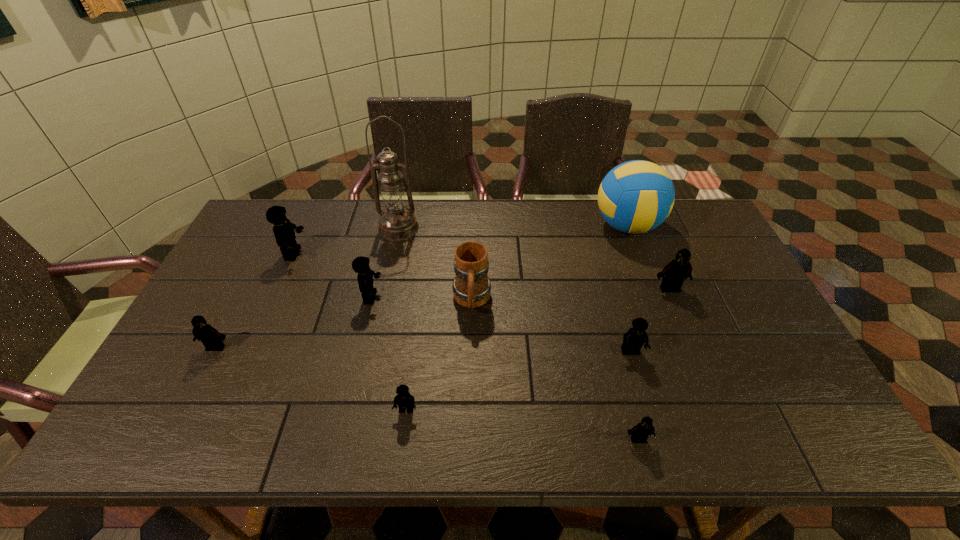
The height and width of the screenshot is (540, 960). Identify the location of vacant space situated on the front-facing side of the farthest yellow Lego. (377, 254).

The height and width of the screenshot is (540, 960). What are the coordinates of `vacant space located on the side of the mug with the handle` in the screenshot? It's located at pos(470,379).

In order to click on vacant space located on the face of the farthest black Lego in this screenshot , I will do `click(686, 328)`.

Image resolution: width=960 pixels, height=540 pixels. I want to click on vacant region located on the front-facing side of the fifth Lego from right to left, so click(x=423, y=298).

You are a GUI agent. You are given a task and a screenshot of the screen. Output one action in this format:
    pyautogui.click(x=<x>, y=<y>)
    Task: Click on the free space located on the face of the leftmost object
    The height and width of the screenshot is (540, 960).
    Given the screenshot: What is the action you would take?
    pyautogui.click(x=167, y=442)

Find the location of a particular element. The image size is (960, 540). vacant space located on the front-facing side of the rightmost yellow Lego is located at coordinates (643, 395).

Locate an element on the screen. This screenshot has height=540, width=960. oil lamp present at the far edge is located at coordinates (396, 223).

Find the location of a particular element. The height and width of the screenshot is (540, 960). volleyball that is at the far edge is located at coordinates (636, 196).

This screenshot has height=540, width=960. In the image, there is a desktop. Find the location of `vacant region at the far edge`. vacant region at the far edge is located at coordinates (322, 212).

I want to click on vacant area at the near edge, so click(264, 437).